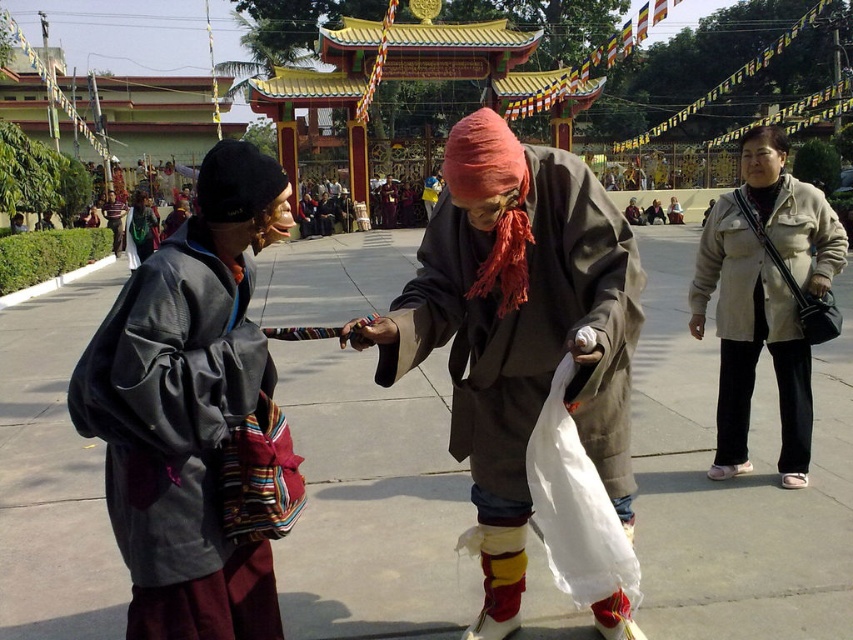
Is beige fabric jacket at right shorter than matte black jacket at center?

Indeed, beige fabric jacket at right has a lesser height compared to matte black jacket at center.

Is point (728, 250) more distant than point (125, 241)?

No, it is not.

I want to click on beige fabric jacket at right, so click(764, 307).

Can you confirm if gray cotton robe at left is taller than beige fabric jacket at right?

In fact, gray cotton robe at left may be shorter than beige fabric jacket at right.

Image resolution: width=853 pixels, height=640 pixels. In order to click on gray cotton robe at left in this screenshot , I will do `click(178, 435)`.

Identify the location of gray cotton robe at left. Image resolution: width=853 pixels, height=640 pixels. (178, 435).

Based on the photo, between matte brown robe at center and matte gray jacket at left, which one has more height?

With more height is matte gray jacket at left.

Based on the photo, is matte brown robe at center smaller than matte gray jacket at left?

Correct, matte brown robe at center occupies less space than matte gray jacket at left.

In order to click on matte brown robe at center in this screenshot , I will do `click(518, 330)`.

Image resolution: width=853 pixels, height=640 pixels. Identify the location of matte brown robe at center. (518, 330).